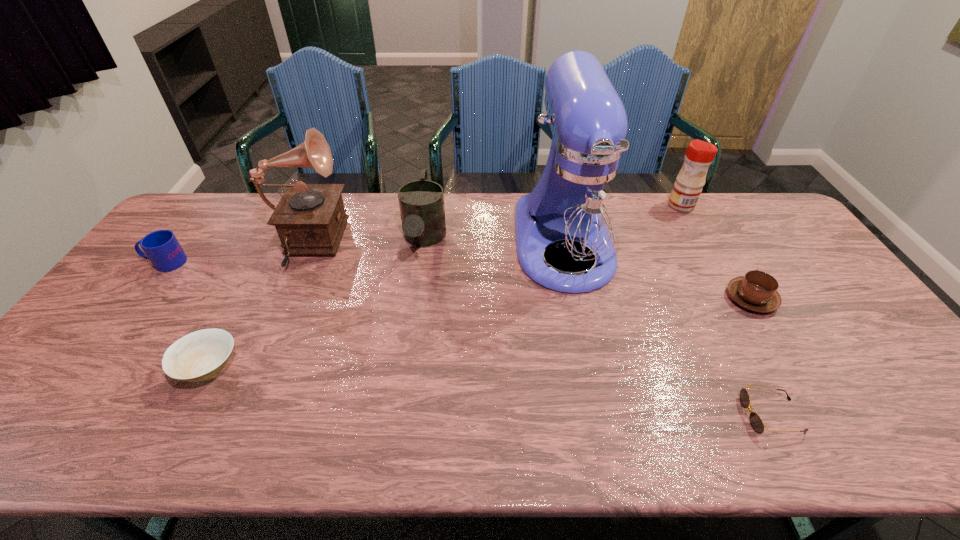
Locate an element on the screen. This screenshot has width=960, height=540. vacant space at the left edge of the desktop is located at coordinates (134, 309).

Locate an element on the screen. free space at the right edge of the desktop is located at coordinates (831, 355).

Image resolution: width=960 pixels, height=540 pixels. Find the location of `free point between the mixer and the cappuccino`. free point between the mixer and the cappuccino is located at coordinates (658, 271).

Find the location of a particular element. empty space between the bowl and the cappuccino is located at coordinates point(480,333).

This screenshot has width=960, height=540. What are the coordinates of `vacant space that's between the cappuccino and the fifth tallest object` in the screenshot? It's located at point(459,280).

Identify the location of vacant area that lies between the cappuccino and the leftmost object. (459, 280).

You are a GUI agent. You are given a task and a screenshot of the screen. Output one action in this format:
    pyautogui.click(x=<x>, y=<y>)
    Task: Click on the empty space between the cappuccino and the sunglasses
    This screenshot has width=960, height=540.
    Given the screenshot: What is the action you would take?
    pyautogui.click(x=761, y=357)

Where is `free space between the seventh shortest object and the sunglasses`? The image size is (960, 540). free space between the seventh shortest object and the sunglasses is located at coordinates (539, 331).

Identify the location of vacant space that is in between the bowl and the tallest object. (386, 305).

The image size is (960, 540). I want to click on free spot between the shortest object and the fifth object from left to right, so click(667, 329).